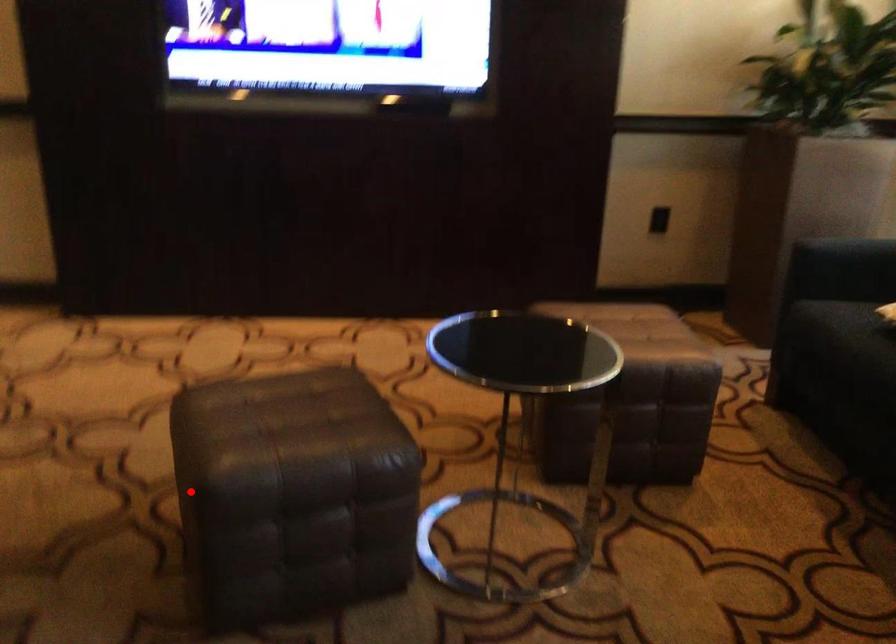
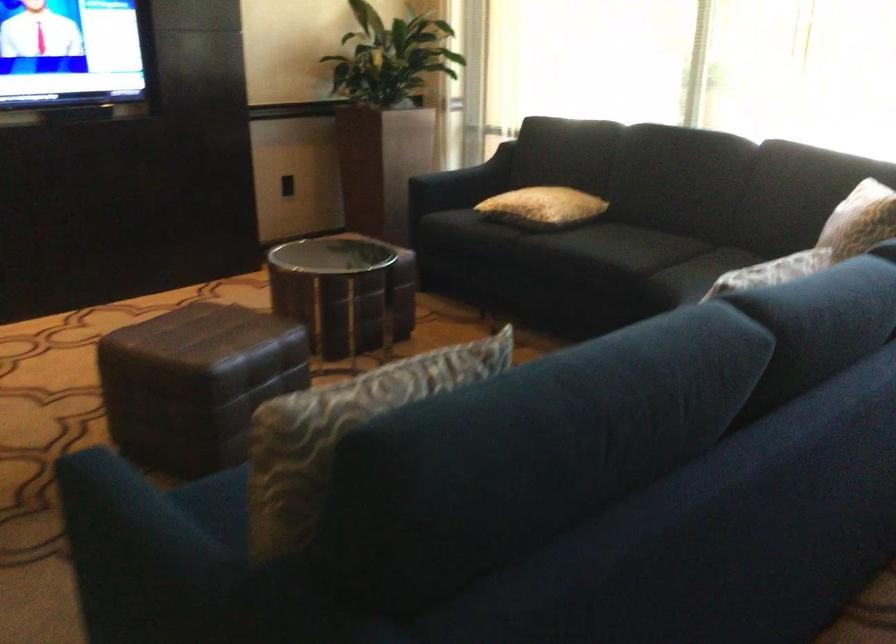
Question: I am providing you with two images of the same scene from different viewpoints. In image1, a red point is highlighted. Considering the same 3D point in image2, which of the following is correct?

Choices:
 (A) It is closer
 (B) It is farther

Answer: (B)